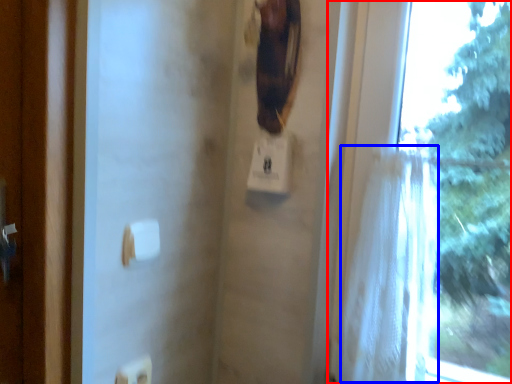
Question: Which object is further to the camera taking this photo, window (highlighted by a red box) or shower curtain (highlighted by a blue box)?

Choices:
 (A) window
 (B) shower curtain

Answer: (B)